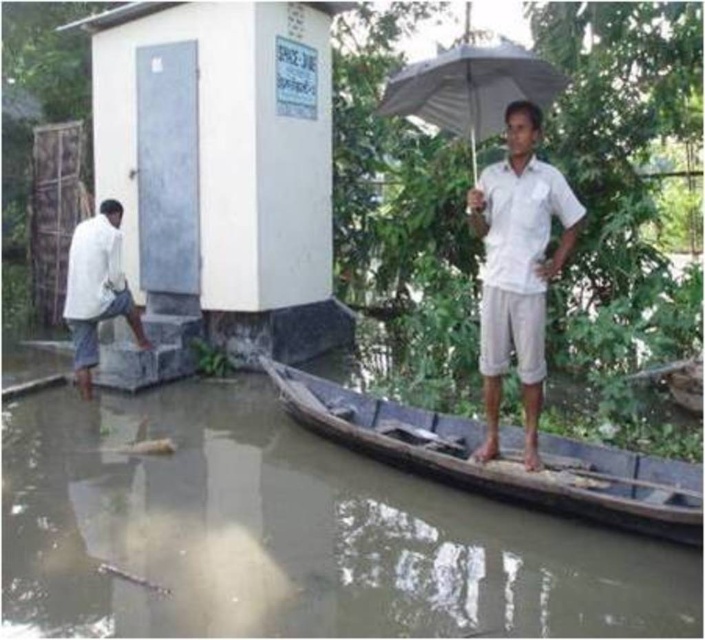
Question: Does brown wooden boat at lower center appear over white matte shirt at left?

Choices:
 (A) no
 (B) yes

Answer: (A)

Question: Estimate the real-world distances between objects in this image. Which object is closer to the white matte shirt at left?

Choices:
 (A) white matte shirt at center
 (B) wooden boat at lower center
 (C) brown wooden boat at lower center
 (D) white painted concrete hut at left

Answer: (D)

Question: Does white painted concrete hut at left come behind white matte shirt at left?

Choices:
 (A) yes
 (B) no

Answer: (A)

Question: Which point is closer to the camera taking this photo?

Choices:
 (A) (627, 454)
 (B) (168, 428)

Answer: (A)

Question: Which object is the closest to the brown wooden boat at lower center?

Choices:
 (A) wooden boat at lower center
 (B) white matte umbrella at upper center
 (C) white matte shirt at center
 (D) white painted concrete hut at left

Answer: (A)

Question: Does brown wooden boat at lower center appear on the left side of white matte umbrella at upper center?

Choices:
 (A) yes
 (B) no

Answer: (A)